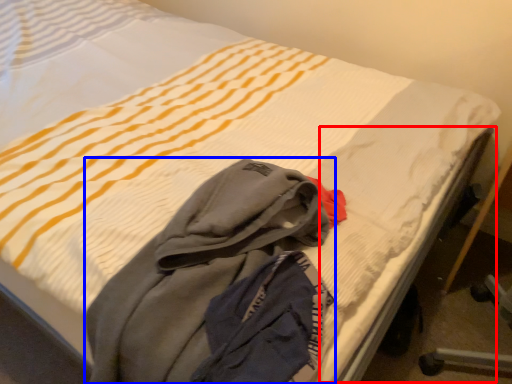
Question: Which of the following is the closest to the observer, bed frame (highlighted by a red box) or laundry (highlighted by a blue box)?

Choices:
 (A) bed frame
 (B) laundry

Answer: (B)